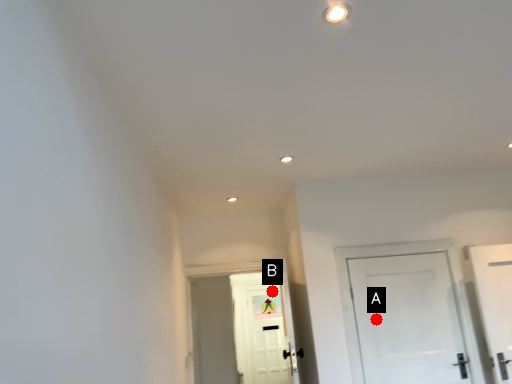
Question: Two points are circled on the image, labeled by A and B beside each circle. Which point appears farthest from the camera in this image?

Choices:
 (A) A is further
 (B) B is further

Answer: (B)